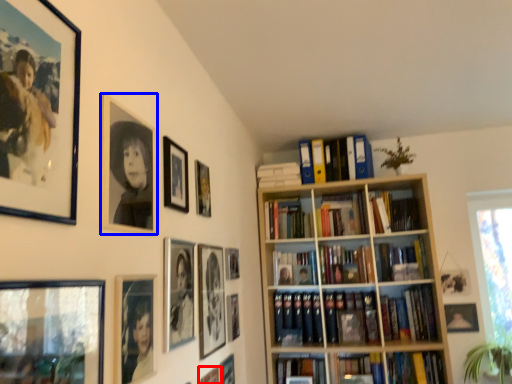
Question: Which object is further to the camera taking this photo, picture frame (highlighted by a red box) or picture frame (highlighted by a blue box)?

Choices:
 (A) picture frame
 (B) picture frame

Answer: (A)